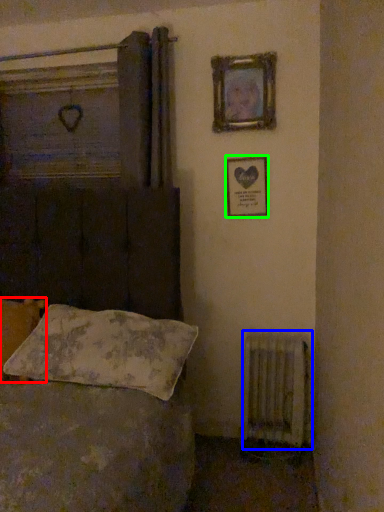
Question: Which object is positioned farthest from pillow (highlighted by a red box)? Select from radiator (highlighted by a blue box) and picture frame (highlighted by a green box).

Choices:
 (A) radiator
 (B) picture frame

Answer: (A)